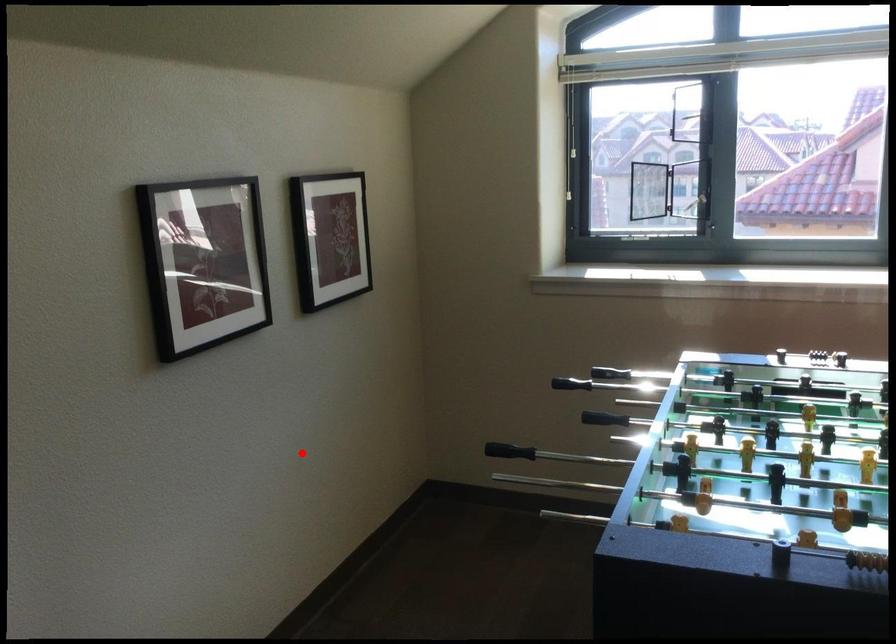
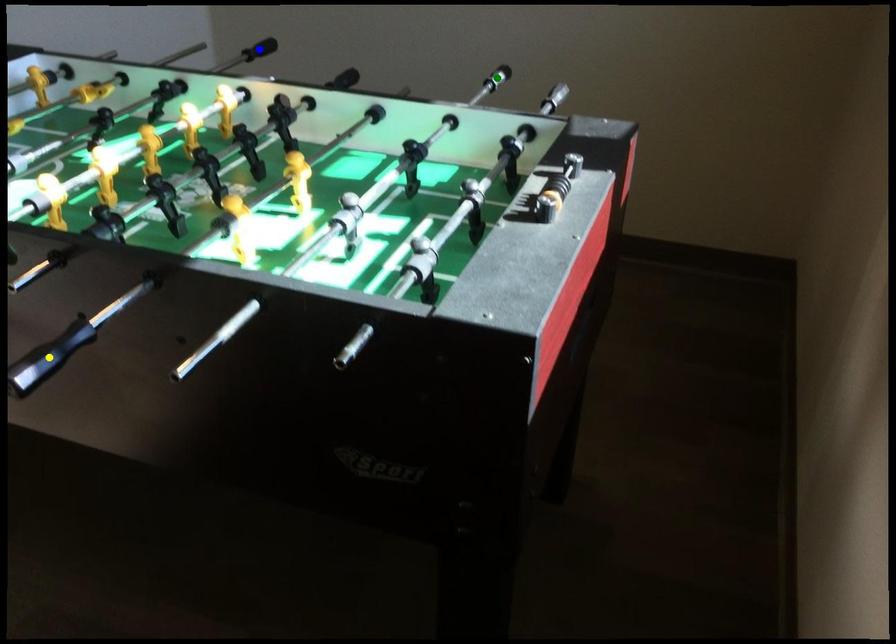
Question: I am providing you with two images of the same scene from different viewpoints. A red point is marked on the first image. You are given multiple points on the second image. Which mark in image 2 goes with the point in image 1?

Choices:
 (A) green point
 (B) yellow point
 (C) blue point

Answer: (A)